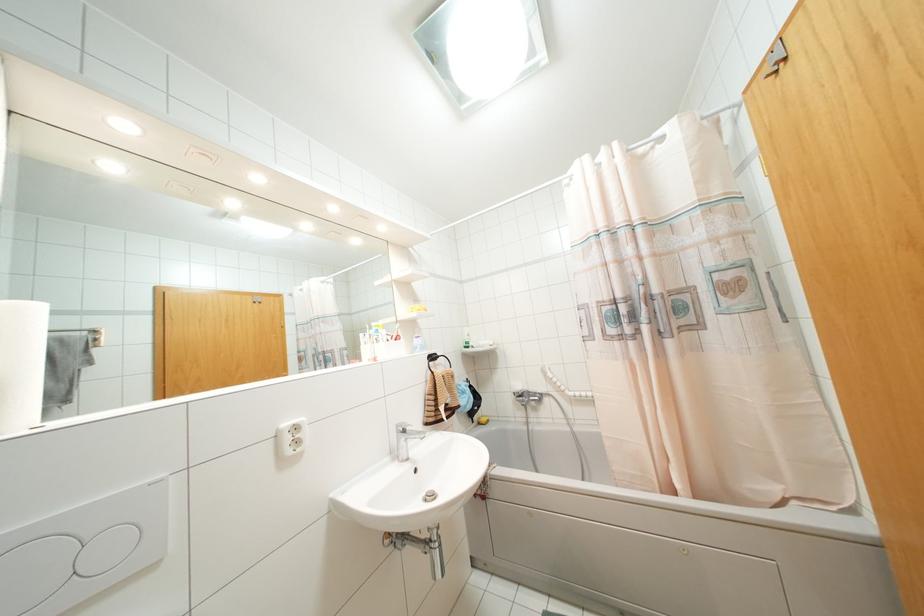
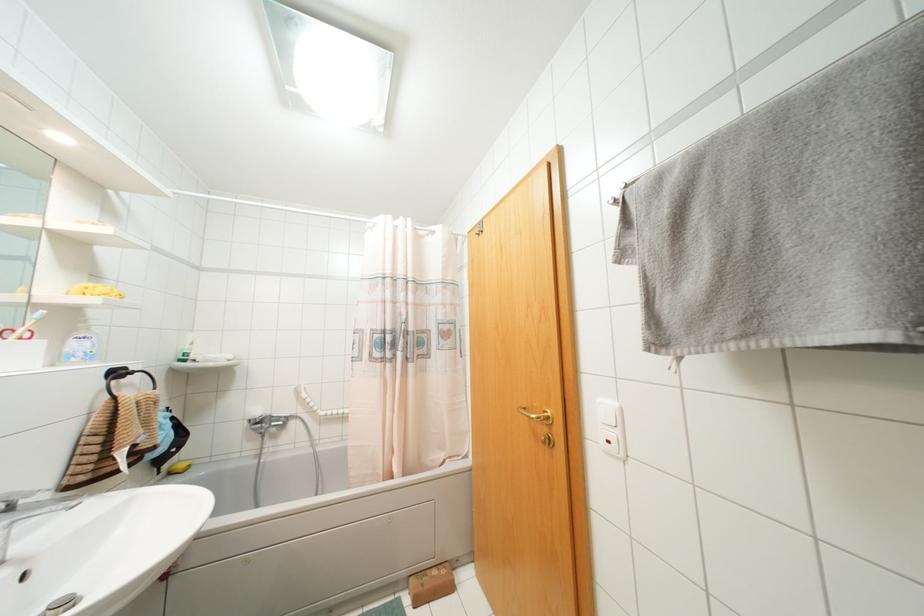
The point at (479, 423) is marked in the first image. Where is the corresponding point in the second image?

(169, 472)